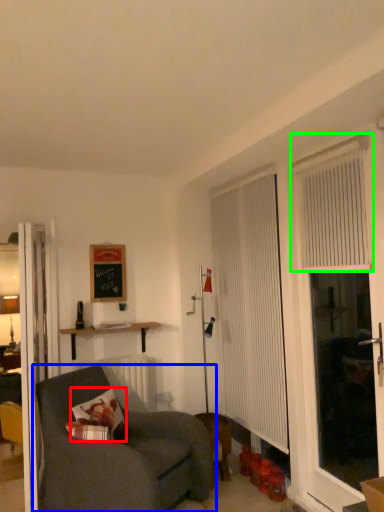
Question: Estimate the real-world distances between objects in this image. Which object is farther from pillow (highlighted by a red box), studio couch (highlighted by a blue box) or curtain (highlighted by a green box)?

Choices:
 (A) studio couch
 (B) curtain

Answer: (B)